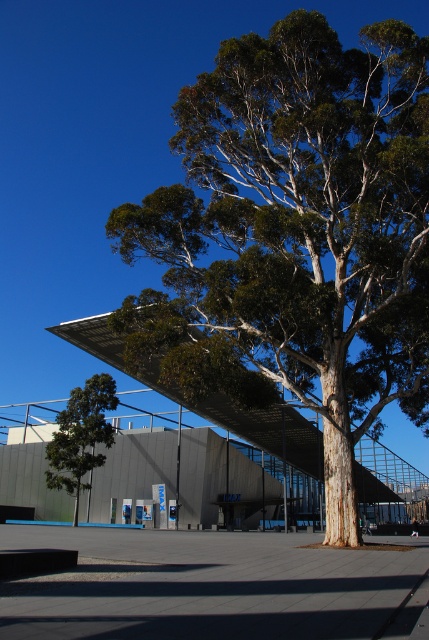
Question: Is green leafy tree at center behind green leafy tree at left?

Choices:
 (A) no
 (B) yes

Answer: (A)

Question: Does green leafy tree at center have a smaller size compared to green leafy tree at left?

Choices:
 (A) yes
 (B) no

Answer: (B)

Question: Among these points, which one is farthest from the camera?

Choices:
 (A) (111, 442)
 (B) (260, 262)

Answer: (A)

Question: Which object is farther from the camera taking this photo?

Choices:
 (A) green leafy tree at left
 (B) green leafy tree at center

Answer: (A)

Question: Does green leafy tree at center have a larger size compared to green leafy tree at left?

Choices:
 (A) no
 (B) yes

Answer: (B)

Question: Which of the following is the closest to the observer?

Choices:
 (A) (175, 250)
 (B) (62, 477)

Answer: (A)